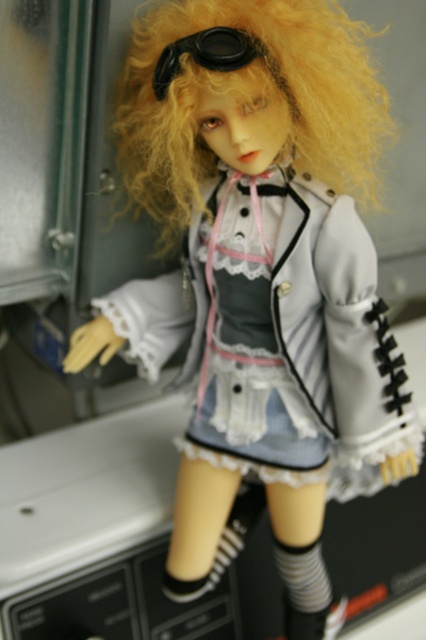
Does curly blonde hair at upper center have a lesser height compared to black matte goggles at upper center?

Incorrect, curly blonde hair at upper center's height does not fall short of black matte goggles at upper center's.

Does curly blonde hair at upper center have a larger size compared to black matte goggles at upper center?

Yes.

Does point (327, 40) lie in front of point (215, 33)?

No, (327, 40) is further to viewer.

Identify the location of curly blonde hair at upper center. The height and width of the screenshot is (640, 426). (245, 99).